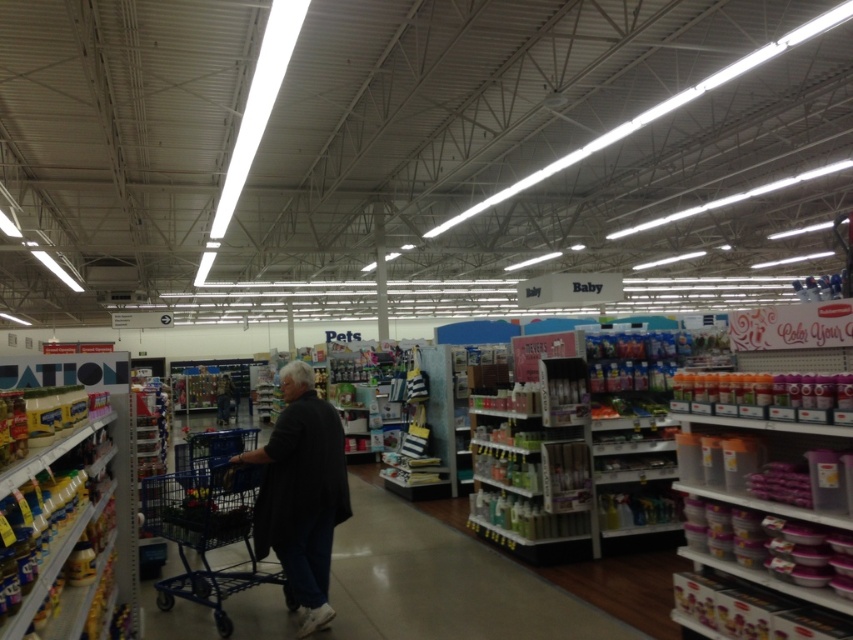
You are standing in the supermarket aisle and want to reach both points marked in the image. Which point, point 1 at coordinates (113, 515) or point 2 at coordinates (224, 576), will you reach first if you walk straight ahead?

You will reach point 1 at coordinates (113, 515) first because it is closer to you than point 2 at coordinates (224, 576).

You are a store employee who needs to place a new sign above the blue metal shopping cart at center. The sign must be placed at a height that is 10 cm above the top of the cart. If the black fabric person at center is 160 cm tall, what is the minimum height from the floor where you should place the sign?

The blue metal shopping cart at center is taller than the black fabric person at center who is 160 cm tall. Since the cart is taller, the sign needs to be placed 10 cm above the cart. Therefore, the minimum height from the floor would be greater than 160 cm plus 10 cm, so over 170 cm.

You are standing in the supermarket aisle and need to locate the metallic yellow canisters at left. According to the store layout, where would you find them?

The metallic yellow canisters at left are located at point (71, 532) in the store layout.